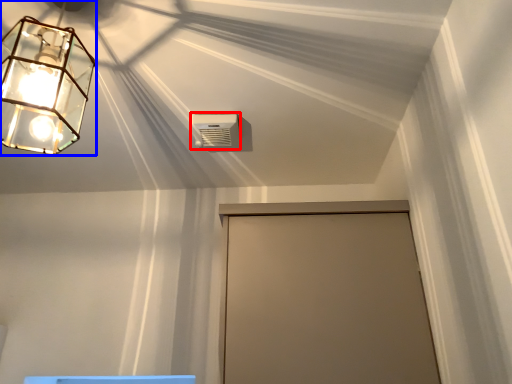
Question: Among these objects, which one is nearest to the camera, air conditioning (highlighted by a red box) or lamp (highlighted by a blue box)?

Choices:
 (A) air conditioning
 (B) lamp

Answer: (B)